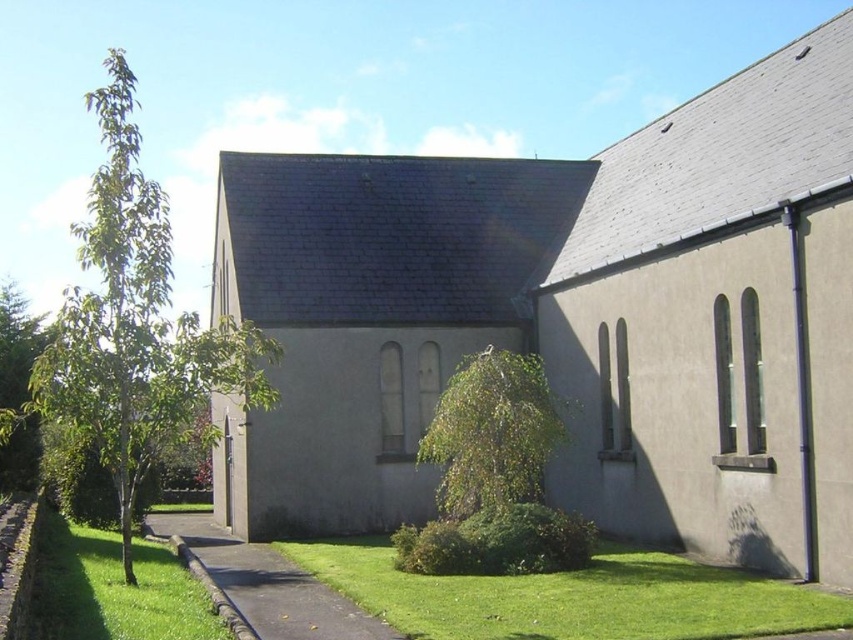
You are standing in front of the church and want to walk from the green leafy tree at left to the green grass at lower center. Which direction should you walk to reach the grass?

The green grass at lower center is behind the green leafy tree at left, so you should walk away from the tree towards the direction opposite of where it is located to reach the grass.

You are standing in front of the church and want to locate the point at coordinates (137, 324). Based on the scene description, where would this point be located relative to the green leafy tree at left?

The point at coordinates (137, 324) is located on the green leafy tree at left.

Looking at this image, you are a gardener who needs to mow the lawn. You see the green leafy tree at left and the green grass at lower center. Which area should you avoid mowing to protect the tree?

You should avoid mowing near the green leafy tree at left because it is bigger than the green grass at lower center, indicating it requires more space and care.